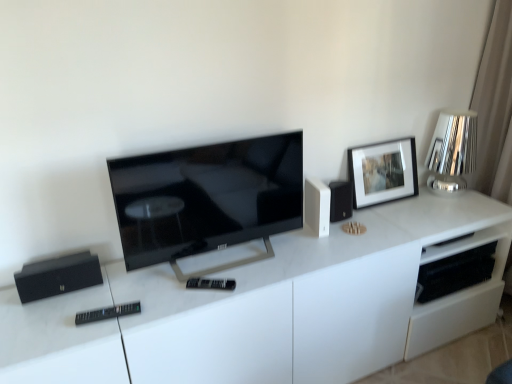
Locate an element on the screen. This screenshot has height=384, width=512. vacant space that is in between black plastic remote at lower left, marked as the 1th remote in a bottom-to-top arrangement, and black plastic remote at center, the second remote positioned from the front is located at coordinates (172, 304).